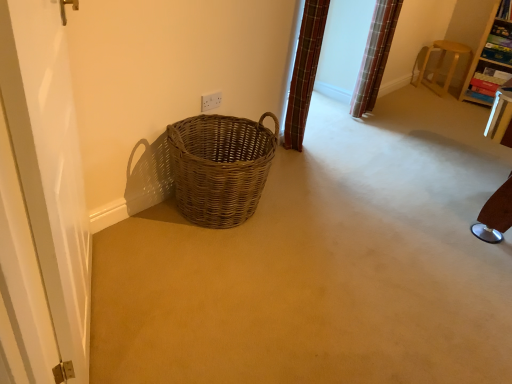
Where is `free space between white glossy screen door at left and light brown wooden stool at upper right, which is the 1th furniture in left-to-right order`? free space between white glossy screen door at left and light brown wooden stool at upper right, which is the 1th furniture in left-to-right order is located at coordinates (319, 170).